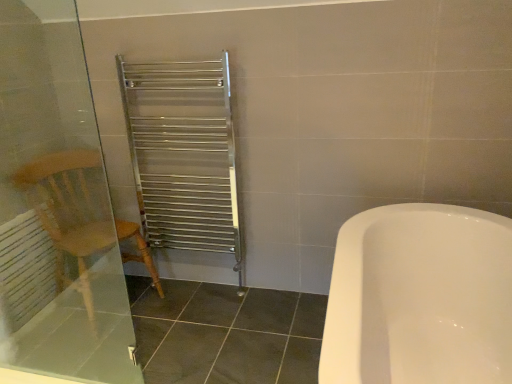
Question: Looking at their shapes, would you say white matte radiator at left is wider or thinner than wooden armchair at left?

Choices:
 (A) thin
 (B) wide

Answer: (A)

Question: Considering the positions of point (32, 314) and point (117, 240), is point (32, 314) closer or farther from the camera than point (117, 240)?

Choices:
 (A) closer
 (B) farther

Answer: (B)

Question: Which of these objects is positioned closest to the transparent glass screen door at left?

Choices:
 (A) wooden armchair at left
 (B) white matte radiator at left

Answer: (A)

Question: Based on their relative distances, which object is farther from the transparent glass screen door at left?

Choices:
 (A) white matte radiator at left
 (B) wooden armchair at left

Answer: (A)